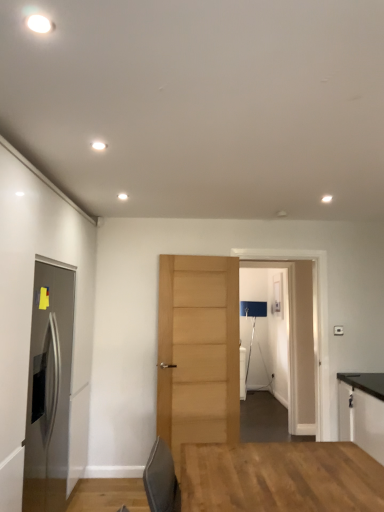
Question: From the image's perspective, is black laminate cabinet at right above or below transparent glass door at center?

Choices:
 (A) below
 (B) above

Answer: (A)

Question: From a real-world perspective, is black laminate cabinet at right above or below transparent glass door at center?

Choices:
 (A) above
 (B) below

Answer: (B)

Question: Which is nearer to the transparent glass door at center?

Choices:
 (A) light brown wood door at center, which is the 1th door from right to left
 (B) black laminate cabinet at right
 (C) satin stainless steel refrigerator at left, which ranks as the first door in left-to-right order

Answer: (B)

Question: Based on their relative distances, which object is nearer to the satin stainless steel refrigerator at left, acting as the second door starting from the back?

Choices:
 (A) black laminate cabinet at right
 (B) transparent glass door at center
 (C) light brown wood door at center, the first door in the back-to-front sequence

Answer: (C)